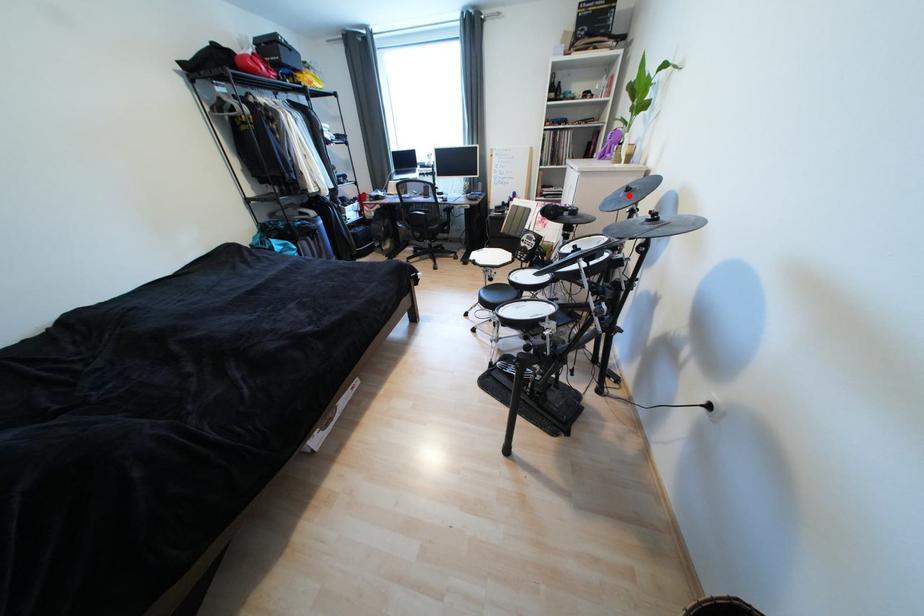
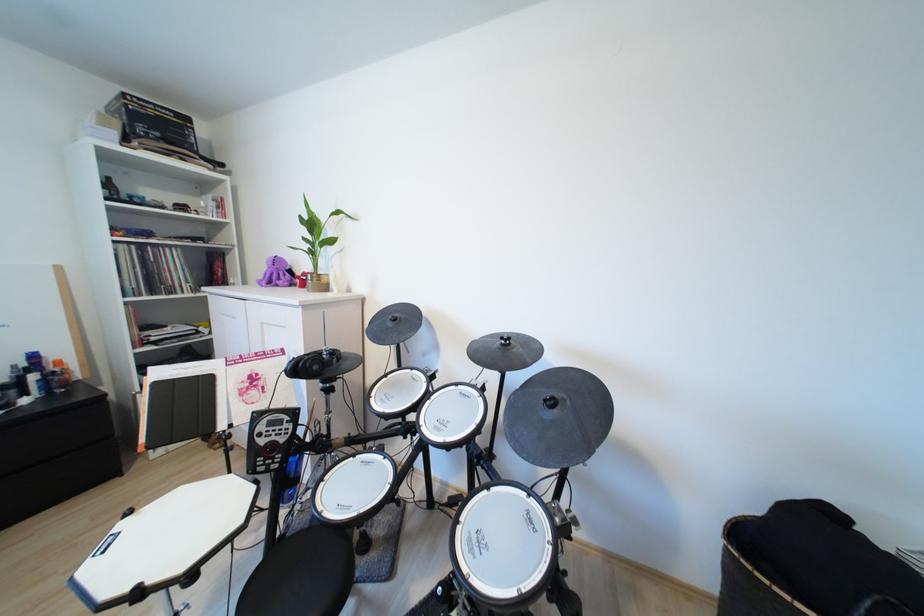
Question: I am providing you with two images of the same scene from different viewpoints. Given a red point in image1, look at the same physical point in image2. Is it:

Choices:
 (A) Closer to the viewpoint
 (B) Farther from the viewpoint

Answer: (B)